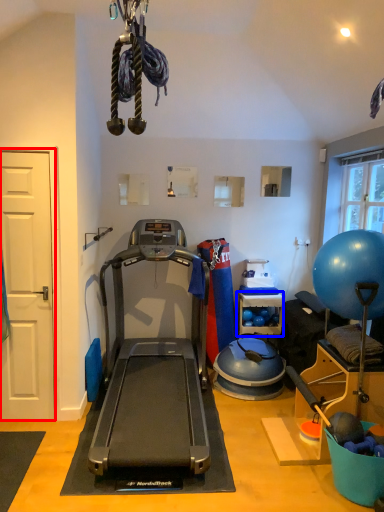
Question: Which of the following is the farthest to the observer, door (highlighted by a red box) or shelf (highlighted by a blue box)?

Choices:
 (A) door
 (B) shelf

Answer: (B)